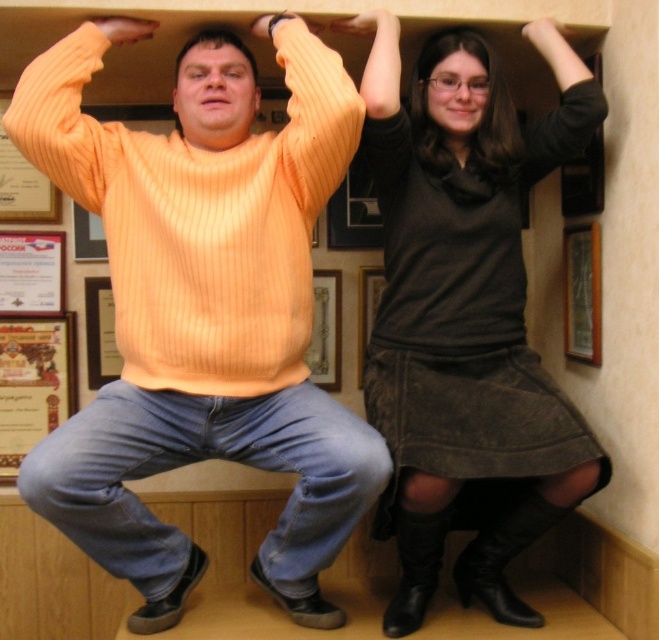
Question: Does dark brown suede skirt at upper right have a smaller size compared to wooden framed poster at left?

Choices:
 (A) no
 (B) yes

Answer: (A)

Question: Is orange ribbed sweater at center to the left of matte black hair at upper center from the viewer's perspective?

Choices:
 (A) yes
 (B) no

Answer: (A)

Question: Which object appears closest to the camera in this image?

Choices:
 (A) orange ribbed sweater at center
 (B) dark brown suede skirt at upper right
 (C) matte orange sweater at center

Answer: (A)

Question: Which point appears closest to the camera in this image?

Choices:
 (A) (426, 147)
 (B) (500, 140)
 (C) (47, 422)

Answer: (B)

Question: Can you confirm if orange ribbed sweater at center is bigger than wooden framed poster at left?

Choices:
 (A) yes
 (B) no

Answer: (A)

Question: Which object appears farthest from the camera in this image?

Choices:
 (A) wooden framed poster at left
 (B) orange ribbed sweater at center
 (C) matte black hair at upper center
 (D) matte orange sweater at center

Answer: (A)